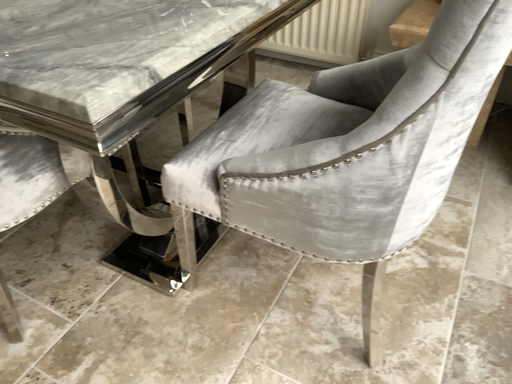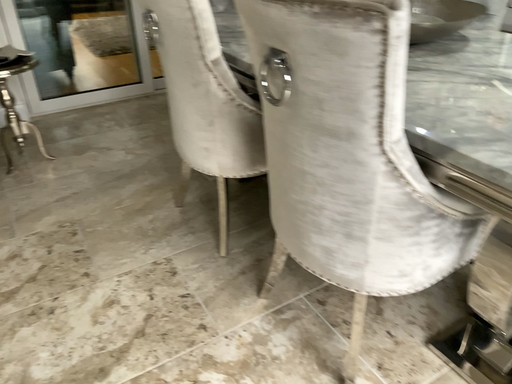
Question: Which way did the camera rotate in the video?

Choices:
 (A) rotated right
 (B) rotated left

Answer: (B)